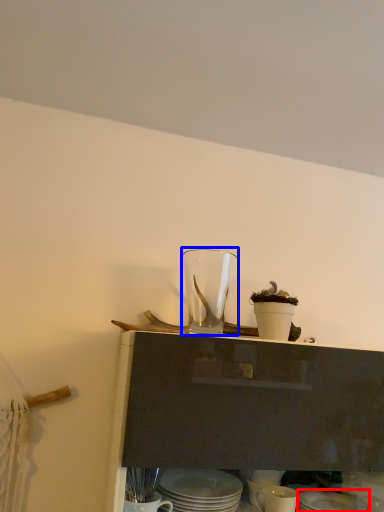
Question: Which object is further to the camera taking this photo, tableware (highlighted by a red box) or tableware (highlighted by a blue box)?

Choices:
 (A) tableware
 (B) tableware

Answer: (B)